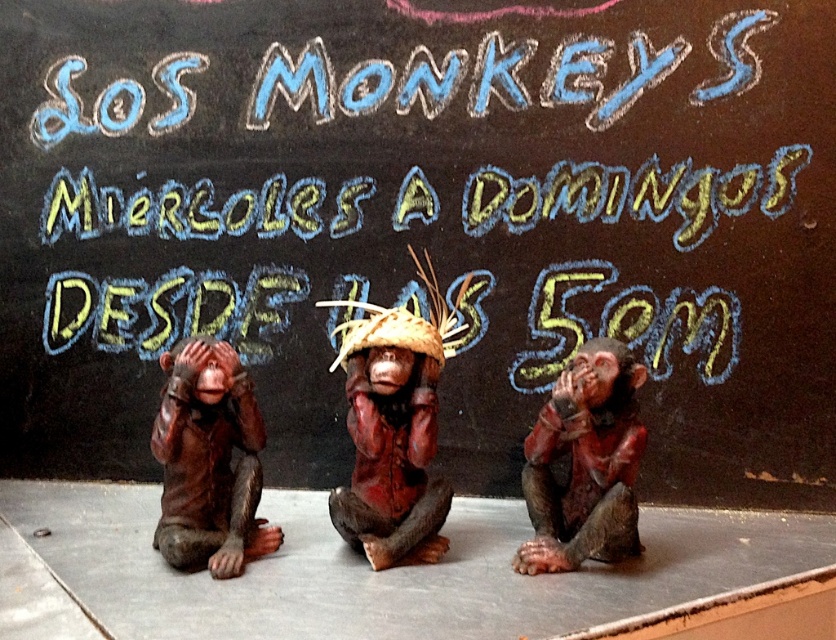
You are an art installer setting up a display. You need to place a new decorative item between the matte brown statue at left and the matte brown monkey at center. The item is 20 inches long. Will there be enough space between them to fit the item?

The matte brown statue at left and the matte brown monkey at center are 24.14 inches apart. Since the item is 20 inches long, there is enough space to fit it between them as 20 inches is less than 24.14 inches.

You are an art student analyzing the arrangement of the monkeys in the scene. Which of the two monkeys, the matte brown statue at left or the matte brown monkey at center, is located to the right of the other?

The matte brown statue at left is positioned on the left side of the matte brown monkey at center, meaning the matte brown monkey at center is to the right of the matte brown statue at left.